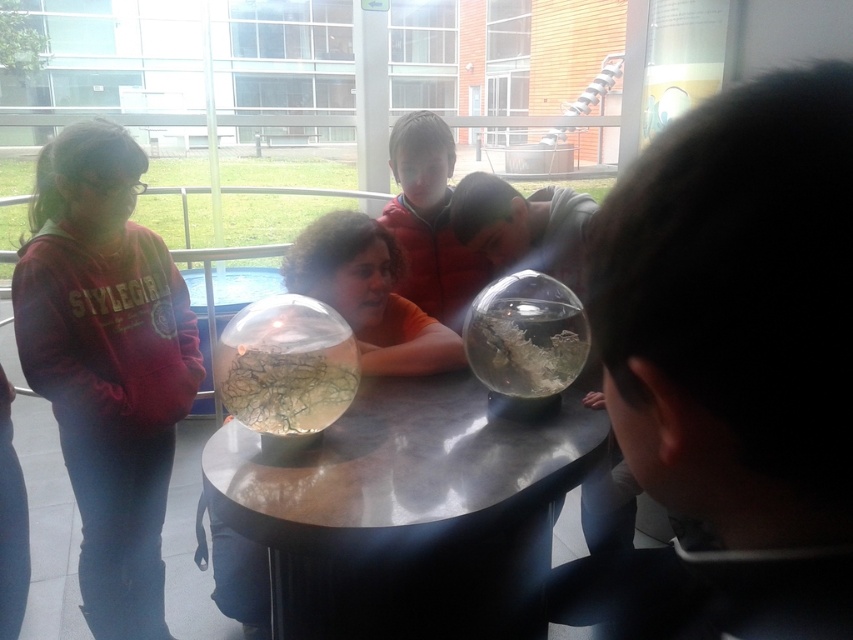
Does matte orange shirt at center have a lesser width compared to translucent glass bowl at center?

Incorrect, matte orange shirt at center's width is not less than translucent glass bowl at center's.

Does matte orange shirt at center come behind translucent glass bowl at center?

Yes.

Is point (386, 301) behind point (329, 406)?

Yes, it is.

At what (x,y) coordinates should I click in order to perform the action: click on matte orange shirt at center. Please return your answer as a coordinate pair (x, y). The height and width of the screenshot is (640, 853). Looking at the image, I should click on [368, 294].

Does matte orange jacket at center appear under translucent glass food at center?

No, matte orange jacket at center is not below translucent glass food at center.

Which is below, matte orange jacket at center or translucent glass food at center?

Positioned lower is translucent glass food at center.

Identify the location of matte orange jacket at center. (428, 220).

Is metallic reflective table at center shorter than transparent glass sphere at center?

No.

Does metallic reflective table at center have a greater width compared to transparent glass sphere at center?

Correct, the width of metallic reflective table at center exceeds that of transparent glass sphere at center.

Who is more distant from viewer, [434,608] or [589,337]?

The point [589,337] is behind.

Find the location of `metallic reflective table at center`. metallic reflective table at center is located at coordinates (407, 512).